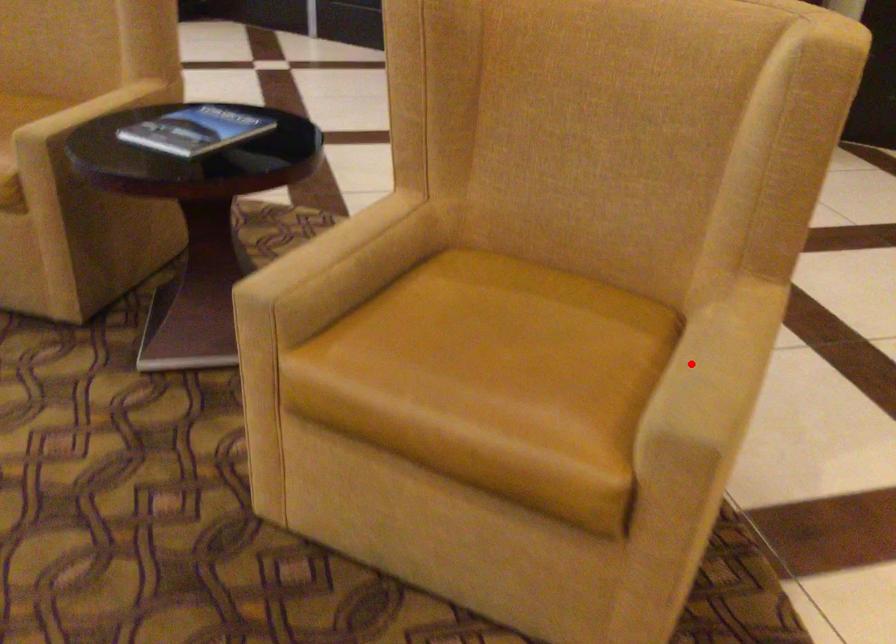
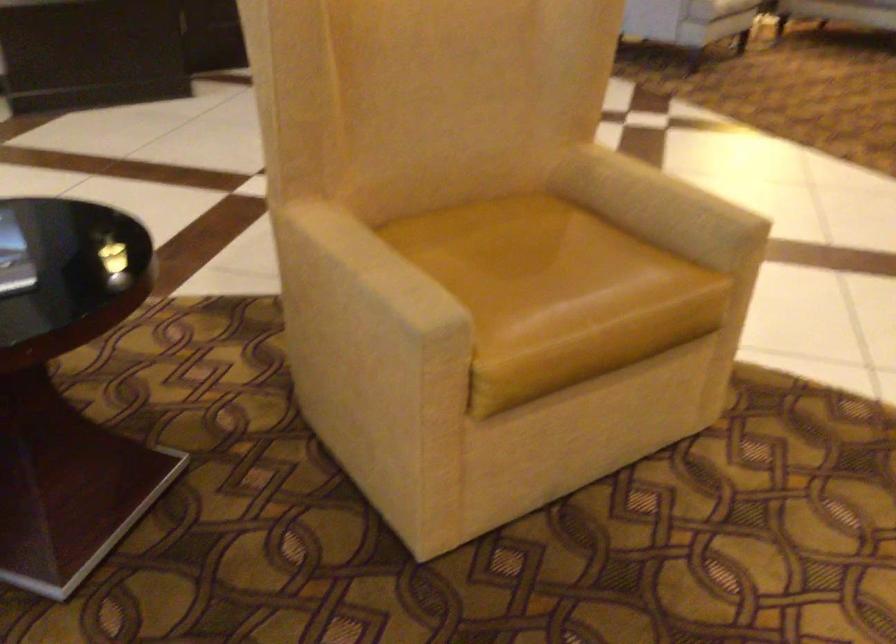
Where in the second image is the point corresponding to the highlighted location from the first image?

(659, 205)